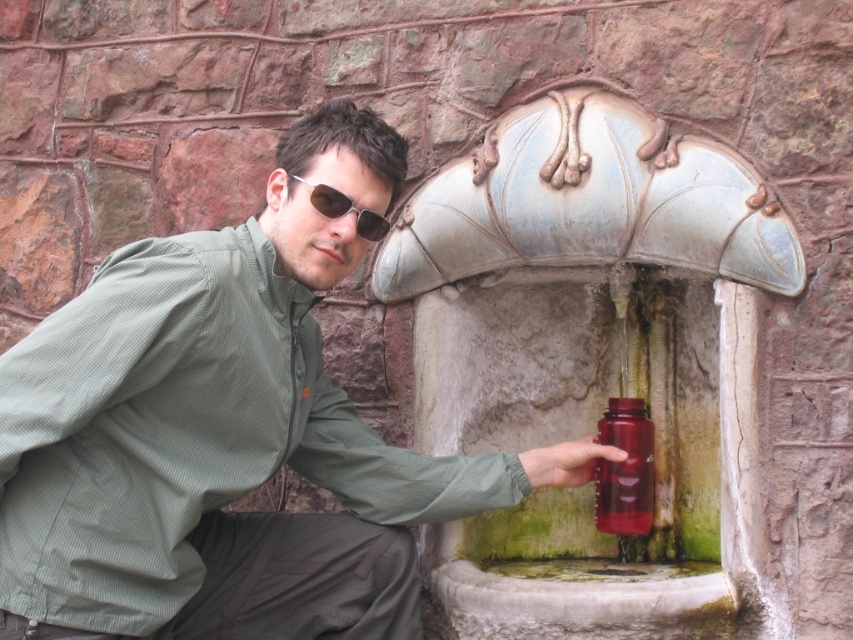
Can you confirm if olive green fabric shirt at center is positioned below translucent red bottle at lower center?

Actually, olive green fabric shirt at center is above translucent red bottle at lower center.

Can you confirm if olive green fabric shirt at center is wider than translucent red bottle at lower center?

Correct, the width of olive green fabric shirt at center exceeds that of translucent red bottle at lower center.

I want to click on olive green fabric shirt at center, so click(x=225, y=433).

Can you confirm if translucent red bottle at lower center is positioned above sunglasses at center?

Incorrect, translucent red bottle at lower center is not positioned above sunglasses at center.

Which is above, translucent red bottle at lower center or sunglasses at center?

sunglasses at center

Between point (596, 428) and point (302, 180), which one is positioned in front?

Positioned in front is point (302, 180).

Find the location of a particular element. This screenshot has width=853, height=640. translucent red bottle at lower center is located at coordinates (625, 468).

Is olive green fabric shirt at center smaller than sunglasses at center?

Incorrect, olive green fabric shirt at center is not smaller in size than sunglasses at center.

Find the location of a particular element. The width and height of the screenshot is (853, 640). olive green fabric shirt at center is located at coordinates (225, 433).